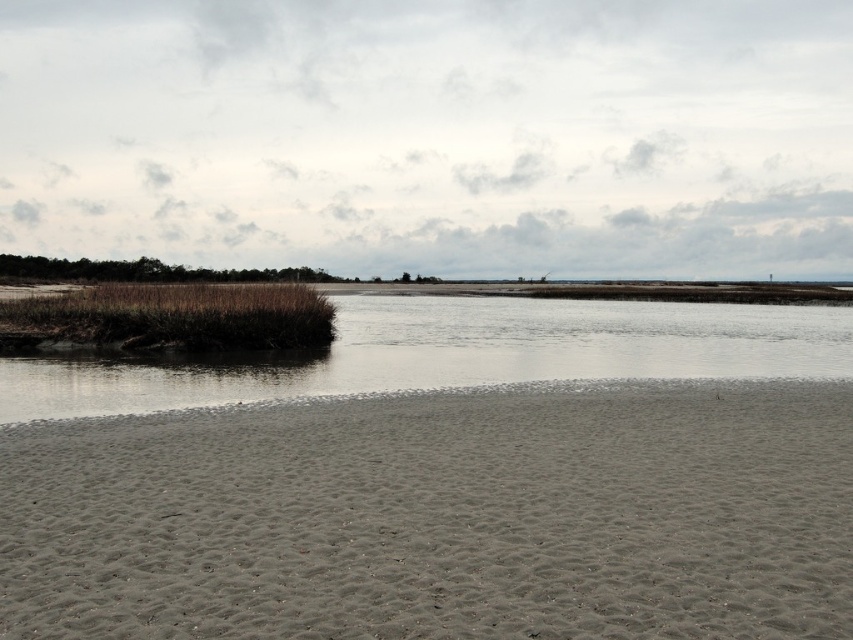
Question: Is brown matte water at center in front of brown grassy wetland at left?

Choices:
 (A) yes
 (B) no

Answer: (A)

Question: Can you confirm if gray sandy beach at lower center is positioned above brown grassy wetland at left?

Choices:
 (A) no
 (B) yes

Answer: (A)

Question: Which object is positioned farthest from the brown grassy wetland at left?

Choices:
 (A) gray sandy beach at lower center
 (B) brown matte water at center

Answer: (A)

Question: In this image, where is brown matte water at center located relative to brown grassy wetland at left?

Choices:
 (A) left
 (B) right

Answer: (B)

Question: Which point appears farthest from the camera in this image?

Choices:
 (A) (436, 477)
 (B) (426, 314)
 (C) (158, 333)

Answer: (B)

Question: Among these objects, which one is farthest from the camera?

Choices:
 (A) brown grassy wetland at left
 (B) gray sandy beach at lower center
 (C) brown matte water at center

Answer: (A)